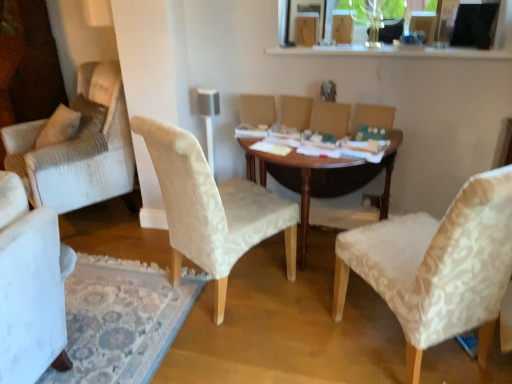
Image resolution: width=512 pixels, height=384 pixels. Describe the element at coordinates (437, 266) in the screenshot. I see `white textured chair at right, acting as the second chair starting from the left` at that location.

In order to face white textured chair at right, marked as the 1th chair in a right-to-left arrangement, should I rotate leftwards or rightwards?

It's best to rotate right around 22.233 degrees.

Where is `wooden table at center`? The width and height of the screenshot is (512, 384). wooden table at center is located at coordinates (321, 177).

At what (x,y) coordinates should I click in order to perform the action: click on white textured chair at right, acting as the second chair starting from the left. Please return your answer as a coordinate pair (x, y). This screenshot has width=512, height=384. Looking at the image, I should click on (437, 266).

From a real-world perspective, relative to white textured chair at right, acting as the second chair starting from the left, is velvet beige armchair at center, which is the second armchair in right-to-left order, vertically above or below?

Clearly, from a real-world perspective, velvet beige armchair at center, which is the second armchair in right-to-left order, is above white textured chair at right, acting as the second chair starting from the left.

Does point (300, 122) lie behind point (409, 323)?

Yes.

From the picture: Who is taller, velvet beige armchair at center, positioned as the first armchair in left-to-right order, or white textured chair at right, marked as the 1th chair in a right-to-left arrangement?

Standing taller between the two is white textured chair at right, marked as the 1th chair in a right-to-left arrangement.

In terms of height, does beige fabric armchair at center, marked as the 1th armchair in a right-to-left arrangement, look taller or shorter compared to white textured chair at center, which is the 2th chair from right to left?

Clearly, beige fabric armchair at center, marked as the 1th armchair in a right-to-left arrangement, is shorter compared to white textured chair at center, which is the 2th chair from right to left.

Is beige fabric armchair at center, which is counted as the second armchair, starting from the left, positioned with its back to white textured chair at center, which is counted as the first chair, starting from the left?

No, beige fabric armchair at center, which is counted as the second armchair, starting from the left,'s orientation is not away from white textured chair at center, which is counted as the first chair, starting from the left.

Which object is further away from the camera taking this photo, beige fabric armchair at center, which is counted as the second armchair, starting from the left, or white textured chair at center, which is counted as the first chair, starting from the left?

beige fabric armchair at center, which is counted as the second armchair, starting from the left, is more distant.

Based on the photo, from the image's perspective, between beige fabric armchair at center, which is counted as the second armchair, starting from the left, and white textured chair at center, which is the 2th chair from right to left, who is located below?

From the image's view, white textured chair at center, which is the 2th chair from right to left, is below.

Could you tell me if beige fabric armchair at center, marked as the 1th armchair in a right-to-left arrangement, is turned towards wooden table at center?

No, beige fabric armchair at center, marked as the 1th armchair in a right-to-left arrangement, is not oriented towards wooden table at center.

Between beige fabric armchair at center, marked as the 1th armchair in a right-to-left arrangement, and wooden table at center, which one is positioned in front?

Positioned in front is wooden table at center.

Measure the distance from beige fabric armchair at center, marked as the 1th armchair in a right-to-left arrangement, to wooden table at center.

beige fabric armchair at center, marked as the 1th armchair in a right-to-left arrangement, is 15.27 inches away from wooden table at center.

Is beige fabric armchair at center, which is counted as the second armchair, starting from the left, to the left or to the right of wooden table at center in the image?

Clearly, beige fabric armchair at center, which is counted as the second armchair, starting from the left, is on the right of wooden table at center in the image.

Considering the relative sizes of white textured chair at center, which is the 2th chair from right to left, and white textured chair at right, acting as the second chair starting from the left, in the image provided, is white textured chair at center, which is the 2th chair from right to left, bigger than white textured chair at right, acting as the second chair starting from the left,?

Actually, white textured chair at center, which is the 2th chair from right to left, might be smaller than white textured chair at right, acting as the second chair starting from the left.

Is white textured chair at center, which is counted as the first chair, starting from the left, far away from white textured chair at right, acting as the second chair starting from the left?

No.

Is white textured chair at center, which is the 2th chair from right to left, completely or partially outside of white textured chair at right, marked as the 1th chair in a right-to-left arrangement?

Yes.

Which is closer to the camera, (158, 145) or (441, 228)?

The point (441, 228) is in front.

Consider the image. Considering the positions of objects velvet beige armchair at center, positioned as the first armchair in left-to-right order, and beige fabric armchair at center, which is counted as the second armchair, starting from the left, in the image provided, who is more to the right, velvet beige armchair at center, positioned as the first armchair in left-to-right order, or beige fabric armchair at center, which is counted as the second armchair, starting from the left,?

From the viewer's perspective, beige fabric armchair at center, which is counted as the second armchair, starting from the left, appears more on the right side.

From the image's perspective, which one is positioned higher, velvet beige armchair at center, which is the second armchair in right-to-left order, or beige fabric armchair at center, which is counted as the second armchair, starting from the left?

velvet beige armchair at center, which is the second armchair in right-to-left order, appears higher in the image.

Is velvet beige armchair at center, which is the second armchair in right-to-left order, oriented away from beige fabric armchair at center, which is counted as the second armchair, starting from the left?

velvet beige armchair at center, which is the second armchair in right-to-left order, does not have its back to beige fabric armchair at center, which is counted as the second armchair, starting from the left.

Between velvet beige armchair at center, positioned as the first armchair in left-to-right order, and beige fabric armchair at center, which is counted as the second armchair, starting from the left, which one has smaller size?

Smaller between the two is beige fabric armchair at center, which is counted as the second armchair, starting from the left.

Does beige fabric armchair at center, which is counted as the second armchair, starting from the left, touch white textured chair at right, marked as the 1th chair in a right-to-left arrangement?

No.

Where is `chair on the right of beige fabric armchair at center, which is counted as the second armchair, starting from the left`? This screenshot has height=384, width=512. chair on the right of beige fabric armchair at center, which is counted as the second armchair, starting from the left is located at coordinates (437, 266).

Does beige fabric armchair at center, marked as the 1th armchair in a right-to-left arrangement, have a smaller size compared to white textured chair at right, marked as the 1th chair in a right-to-left arrangement?

Yes, beige fabric armchair at center, marked as the 1th armchair in a right-to-left arrangement, is smaller than white textured chair at right, marked as the 1th chair in a right-to-left arrangement.

Which object is further away from the camera taking this photo, white textured chair at center, which is counted as the first chair, starting from the left, or beige fabric armchair at center, marked as the 1th armchair in a right-to-left arrangement?

beige fabric armchair at center, marked as the 1th armchair in a right-to-left arrangement, is behind.

Considering the sizes of objects white textured chair at center, which is counted as the first chair, starting from the left, and beige fabric armchair at center, marked as the 1th armchair in a right-to-left arrangement, in the image provided, who is wider, white textured chair at center, which is counted as the first chair, starting from the left, or beige fabric armchair at center, marked as the 1th armchair in a right-to-left arrangement,?

white textured chair at center, which is counted as the first chair, starting from the left, is wider.

Is white textured chair at center, which is counted as the first chair, starting from the left, located outside beige fabric armchair at center, marked as the 1th armchair in a right-to-left arrangement?

white textured chair at center, which is counted as the first chair, starting from the left, is positioned outside beige fabric armchair at center, marked as the 1th armchair in a right-to-left arrangement.

Is white textured chair at center, which is counted as the first chair, starting from the left, in contact with beige fabric armchair at center, marked as the 1th armchair in a right-to-left arrangement?

white textured chair at center, which is counted as the first chair, starting from the left, and beige fabric armchair at center, marked as the 1th armchair in a right-to-left arrangement, are clearly separated.

The image size is (512, 384). What are the coordinates of `the 2nd armchair behind the white textured chair at right, acting as the second chair starting from the left, counting from the anchor's position` in the screenshot? It's located at (296, 111).

At what (x,y) coordinates should I click in order to perform the action: click on chair that is the 2nd object directly below the beige fabric armchair at center, marked as the 1th armchair in a right-to-left arrangement (from a real-world perspective). Please return your answer as a coordinate pair (x, y). Image resolution: width=512 pixels, height=384 pixels. Looking at the image, I should click on (212, 208).

Estimate the real-world distances between objects in this image. Which object is closer to white textured chair at right, acting as the second chair starting from the left, beige fabric armchair at center, which is counted as the second armchair, starting from the left, or velvet beige armchair at center, which is the second armchair in right-to-left order?

beige fabric armchair at center, which is counted as the second armchair, starting from the left, is positioned closer to the anchor white textured chair at right, acting as the second chair starting from the left.

Consider the image. When comparing their distances from white textured chair at right, marked as the 1th chair in a right-to-left arrangement, does white textured chair at center, which is the 2th chair from right to left, or wooden table at center seem closer?

wooden table at center.

From the image, which object appears to be nearer to wooden table at center, beige fabric armchair at center, which is counted as the second armchair, starting from the left, or velvet beige armchair at center, which is the second armchair in right-to-left order?

Among the two, beige fabric armchair at center, which is counted as the second armchair, starting from the left, is located nearer to wooden table at center.

When comparing their distances from white textured chair at right, marked as the 1th chair in a right-to-left arrangement, does wooden table at center or white textured chair at center, which is counted as the first chair, starting from the left, seem closer?

wooden table at center is closer to white textured chair at right, marked as the 1th chair in a right-to-left arrangement.

Based on the photo, from the image, which object appears to be farther from white textured chair at right, acting as the second chair starting from the left, velvet beige armchair at center, which is the second armchair in right-to-left order, or wooden table at center?

Based on the image, velvet beige armchair at center, which is the second armchair in right-to-left order, appears to be further to white textured chair at right, acting as the second chair starting from the left.

Estimate the real-world distances between objects in this image. Which object is further from beige fabric armchair at center, which is counted as the second armchair, starting from the left, white textured chair at right, acting as the second chair starting from the left, or wooden table at center?

white textured chair at right, acting as the second chair starting from the left, is positioned further to the anchor beige fabric armchair at center, which is counted as the second armchair, starting from the left.

When comparing their distances from velvet beige armchair at center, which is the second armchair in right-to-left order, does white textured chair at right, acting as the second chair starting from the left, or white textured chair at center, which is counted as the first chair, starting from the left, seem further?

white textured chair at right, acting as the second chair starting from the left, is further to velvet beige armchair at center, which is the second armchair in right-to-left order.

When comparing their distances from velvet beige armchair at center, which is the second armchair in right-to-left order, does beige fabric armchair at center, marked as the 1th armchair in a right-to-left arrangement, or white textured chair at center, which is counted as the first chair, starting from the left, seem closer?

Based on the image, beige fabric armchair at center, marked as the 1th armchair in a right-to-left arrangement, appears to be nearer to velvet beige armchair at center, which is the second armchair in right-to-left order.

The image size is (512, 384). Identify the location of table between white textured chair at center, which is counted as the first chair, starting from the left, and velvet beige armchair at center, positioned as the first armchair in left-to-right order, from front to back. (321, 177).

At what (x,y) coordinates should I click in order to perform the action: click on chair positioned between white textured chair at right, acting as the second chair starting from the left, and beige fabric armchair at center, marked as the 1th armchair in a right-to-left arrangement, from near to far. Please return your answer as a coordinate pair (x, y). Image resolution: width=512 pixels, height=384 pixels. Looking at the image, I should click on (212, 208).

Identify the location of table between white textured chair at center, which is counted as the first chair, starting from the left, and white textured chair at right, acting as the second chair starting from the left. Image resolution: width=512 pixels, height=384 pixels. (321, 177).

Where is `armchair between white textured chair at right, marked as the 1th chair in a right-to-left arrangement, and velvet beige armchair at center, positioned as the first armchair in left-to-right order, in the front-back direction`? The image size is (512, 384). armchair between white textured chair at right, marked as the 1th chair in a right-to-left arrangement, and velvet beige armchair at center, positioned as the first armchair in left-to-right order, in the front-back direction is located at coordinates point(330,118).